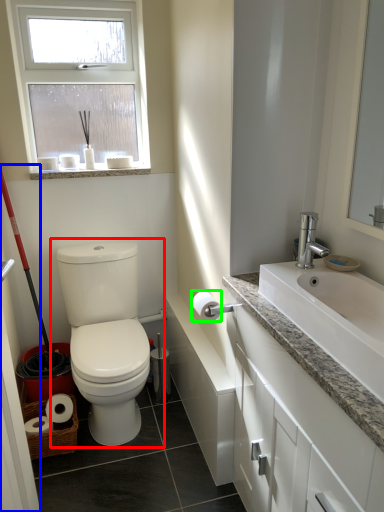
Question: Considering the real-world distances, which object is closest to toilet (highlighted by a red box)? screen door (highlighted by a blue box) or toilet paper (highlighted by a green box).

Choices:
 (A) screen door
 (B) toilet paper

Answer: (B)